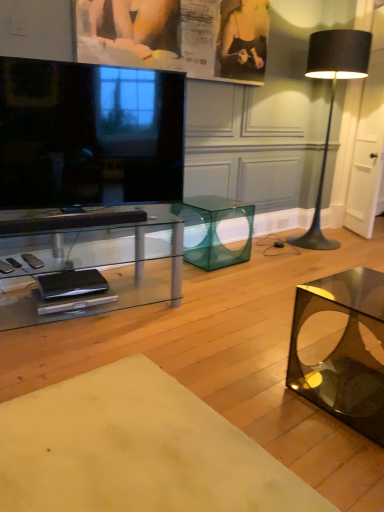
This screenshot has width=384, height=512. What are the coordinates of `free point in front of clear glass table at center, the second table positioned from the front` in the screenshot? It's located at (86, 366).